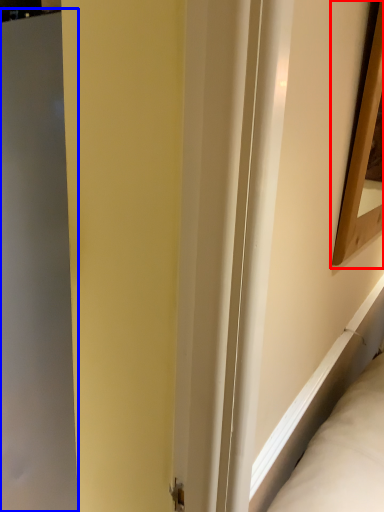
Question: Which object is further to the camera taking this photo, picture frame (highlighted by a red box) or screen door (highlighted by a blue box)?

Choices:
 (A) picture frame
 (B) screen door

Answer: (B)